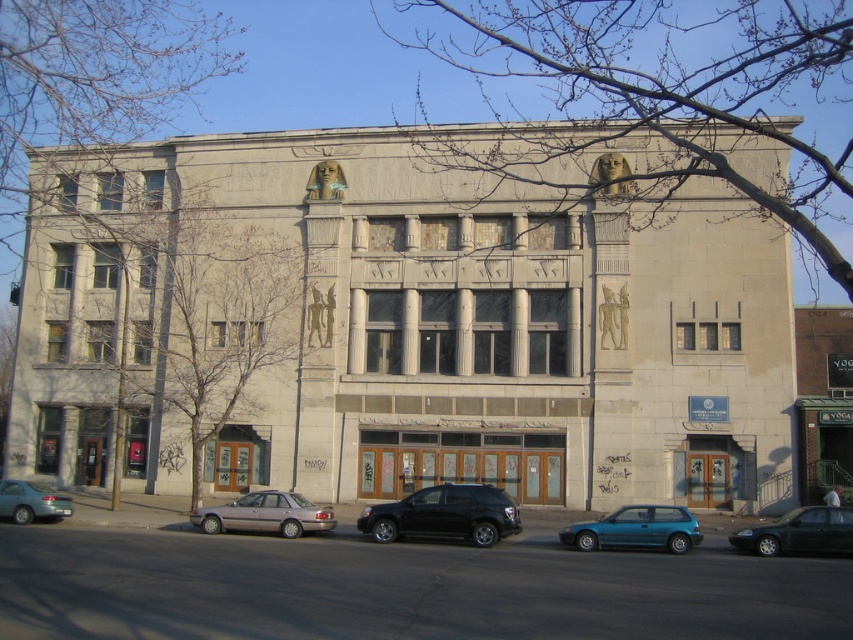
Question: Considering the relative positions of black matte suv at center and satin silver sedan at lower center in the image provided, where is black matte suv at center located with respect to satin silver sedan at lower center?

Choices:
 (A) below
 (B) above

Answer: (A)

Question: From the image, what is the correct spatial relationship of metallic blue hatchback at center in relation to satin silver sedan at lower center?

Choices:
 (A) left
 (B) right

Answer: (B)

Question: Considering the real-world distances, which object is closest to the teal matte sedan at lower left?

Choices:
 (A) metallic blue hatchback at center
 (B) satin silver sedan at lower center
 (C) black matte suv at center

Answer: (B)

Question: Where is green matte sedan at lower right located in relation to teal matte sedan at lower left in the image?

Choices:
 (A) right
 (B) left

Answer: (A)

Question: Estimate the real-world distances between objects in this image. Which object is closer to the teal matte sedan at lower left?

Choices:
 (A) black matte suv at center
 (B) satin silver sedan at lower center
 (C) metallic blue hatchback at center
 (D) green matte sedan at lower right

Answer: (B)

Question: Which point appears farthest from the camera in this image?

Choices:
 (A) (389, 540)
 (B) (576, 541)

Answer: (A)